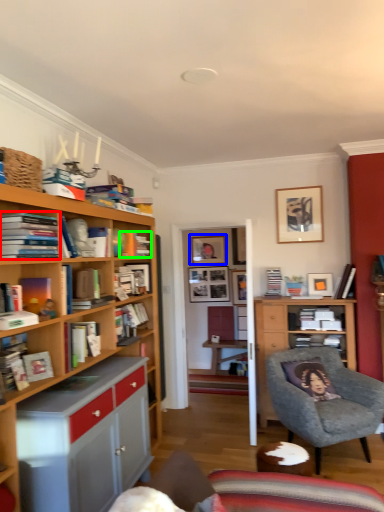
Question: Which is farther away from book (highlighted by a red box)? picture frame (highlighted by a blue box) or book (highlighted by a green box)?

Choices:
 (A) picture frame
 (B) book

Answer: (A)